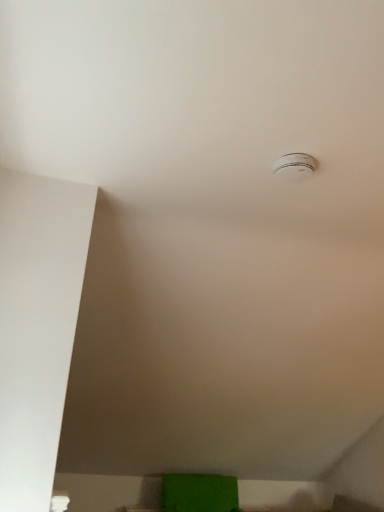
This screenshot has width=384, height=512. What do you see at coordinates (199, 493) in the screenshot? I see `green fabric swivel chair at lower center` at bounding box center [199, 493].

You are a GUI agent. You are given a task and a screenshot of the screen. Output one action in this format:
    pyautogui.click(x=<x>, y=<y>)
    Task: Click on the green fabric swivel chair at lower center
    The width and height of the screenshot is (384, 512).
    Given the screenshot: What is the action you would take?
    pyautogui.click(x=199, y=493)

Measure the distance between green fabric swivel chair at lower center and camera.

A distance of 3.21 meters exists between green fabric swivel chair at lower center and camera.

Where is `green fabric swivel chair at lower center`? green fabric swivel chair at lower center is located at coordinates (199, 493).